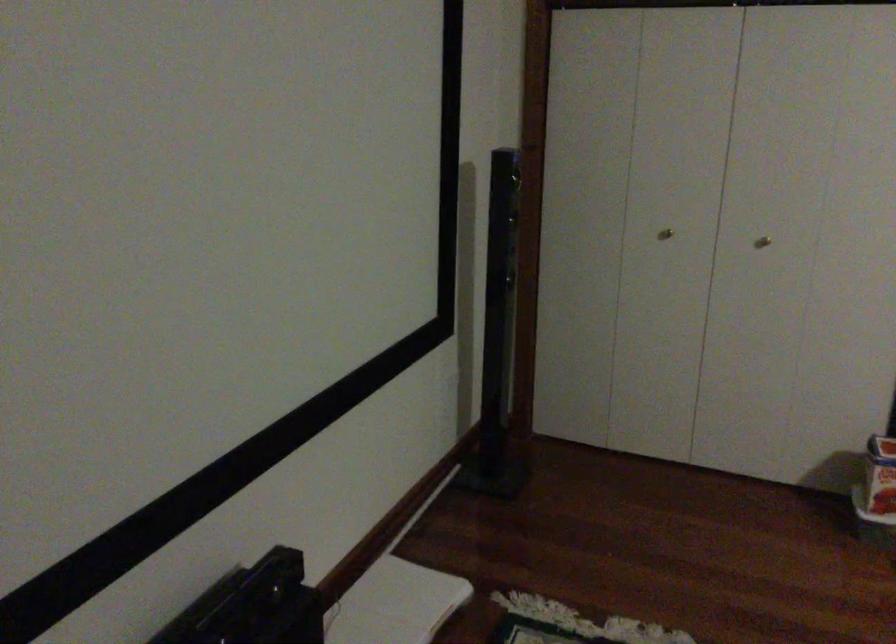
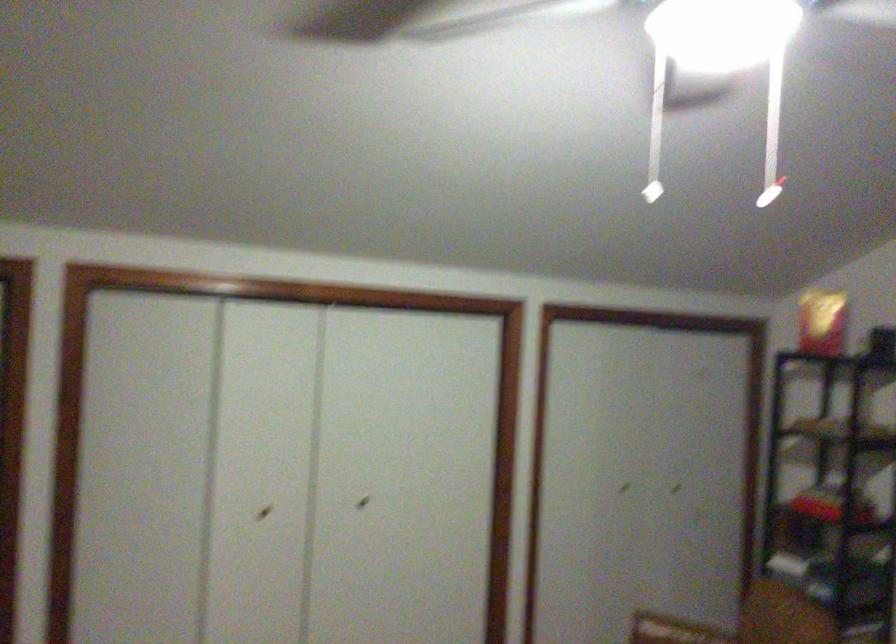
Question: Based on the continuous images, in which direction is the camera rotating? Reply with the corresponding letter.

Choices:
 (A) Left
 (B) Right
 (C) Up
 (D) Down

Answer: (B)